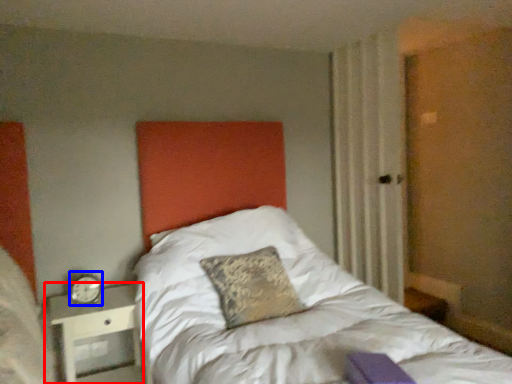
Question: Which object is closer to the camera taking this photo, nightstand (highlighted by a red box) or alarm clock (highlighted by a blue box)?

Choices:
 (A) nightstand
 (B) alarm clock

Answer: (A)